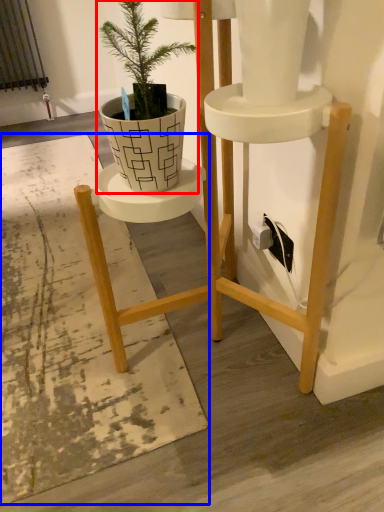
Question: Which of the following is the closest to the observer, houseplant (highlighted by a red box) or mat (highlighted by a blue box)?

Choices:
 (A) houseplant
 (B) mat

Answer: (A)